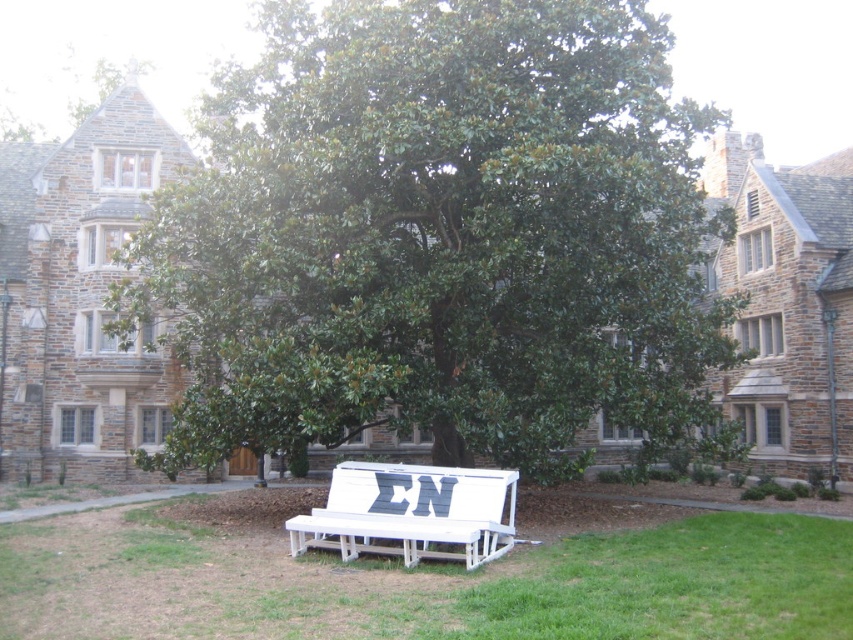
Question: Observing the image, what is the correct spatial positioning of green leafy tree at center in reference to white painted wood bench at center?

Choices:
 (A) below
 (B) above

Answer: (B)

Question: Which object is farther from the camera taking this photo?

Choices:
 (A) white painted wood bench at center
 (B) green leafy tree at center
 (C) white wooden bench at center

Answer: (B)

Question: Can you confirm if white wooden bench at center is positioned to the right of white painted wood bench at center?

Choices:
 (A) no
 (B) yes

Answer: (B)

Question: Is green leafy tree at center in front of white wooden bench at center?

Choices:
 (A) no
 (B) yes

Answer: (A)

Question: Among these objects, which one is farthest from the camera?

Choices:
 (A) green leafy tree at center
 (B) white painted wood bench at center

Answer: (A)

Question: Which of these objects is positioned closest to the white painted wood bench at center?

Choices:
 (A) green leafy tree at center
 (B) white wooden bench at center

Answer: (B)